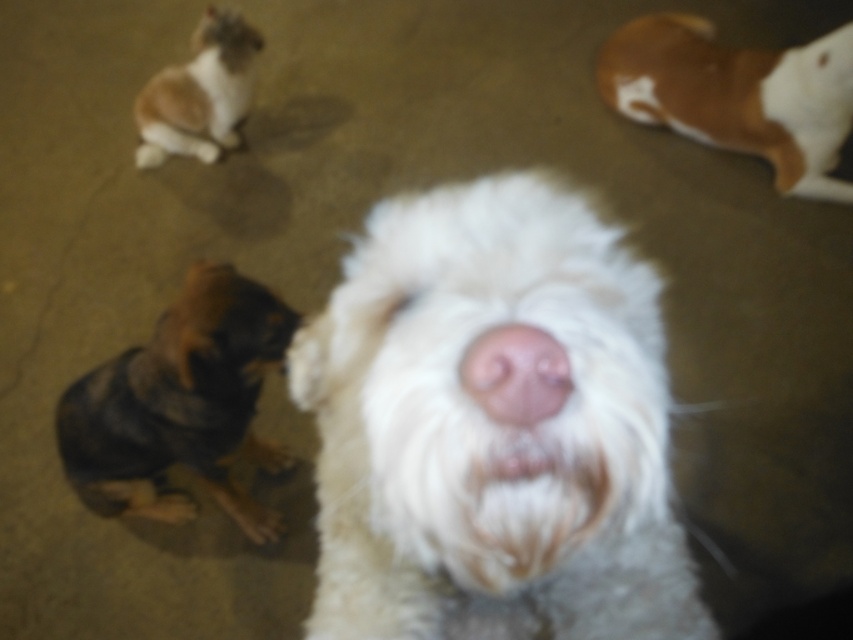
Question: Does white fluffy dog at center have a greater width compared to pink soft nose at center?

Choices:
 (A) no
 (B) yes

Answer: (B)

Question: Which object appears closest to the camera in this image?

Choices:
 (A) white fluffy dog at center
 (B) brown fur at upper right
 (C) brown and black fur at lower left
 (D) brown fur dog at upper left

Answer: (A)

Question: Can you confirm if brown fur at upper right is positioned to the right of pink soft nose at center?

Choices:
 (A) no
 (B) yes

Answer: (B)

Question: Is brown fur at upper right further to the viewer compared to brown fur dog at upper left?

Choices:
 (A) no
 (B) yes

Answer: (A)

Question: Among these points, which one is nearest to the camera?

Choices:
 (A) (805, 141)
 (B) (221, 72)
 (C) (521, 384)

Answer: (C)

Question: Which point is closer to the camera?

Choices:
 (A) pyautogui.click(x=312, y=392)
 (B) pyautogui.click(x=793, y=129)
 (C) pyautogui.click(x=546, y=400)
 (D) pyautogui.click(x=196, y=104)

Answer: (C)